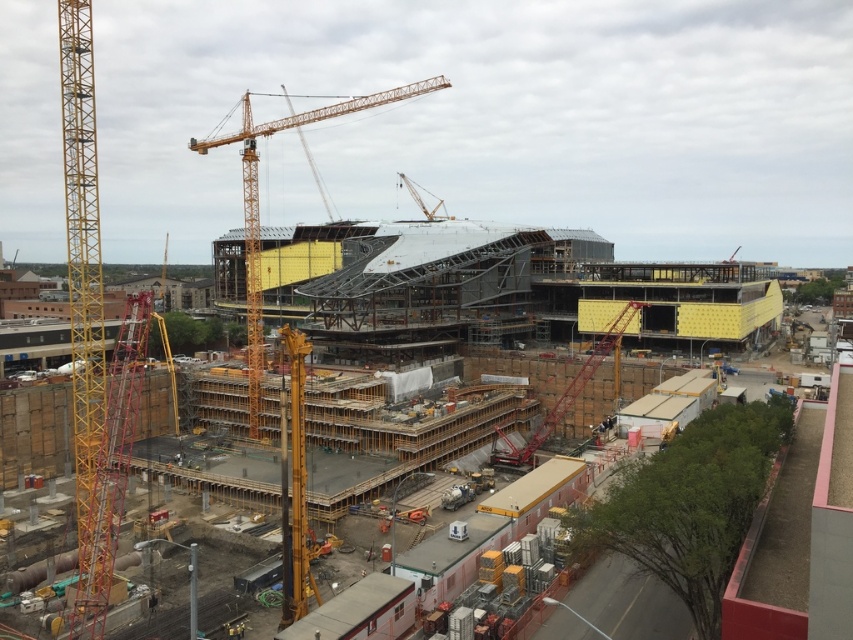
Question: Can you confirm if yellow wood construction site at center is smaller than yellow metallic crane at left?

Choices:
 (A) no
 (B) yes

Answer: (A)

Question: Which object is closer to the camera taking this photo?

Choices:
 (A) yellow metallic crane at upper left
 (B) yellow metallic crane at left

Answer: (B)

Question: Which of the following is the closest to the observer?

Choices:
 (A) (x=250, y=326)
 (B) (x=695, y=268)

Answer: (A)

Question: Is yellow wood construction site at center wider than yellow metallic crane at left?

Choices:
 (A) no
 (B) yes

Answer: (B)

Question: Can you confirm if yellow metallic crane at left is positioned to the left of yellow metallic crane at upper left?

Choices:
 (A) yes
 (B) no

Answer: (B)

Question: Which point is farther from the camera taking this photo?

Choices:
 (A) (252, 184)
 (B) (450, 225)
 (C) (106, 528)

Answer: (B)